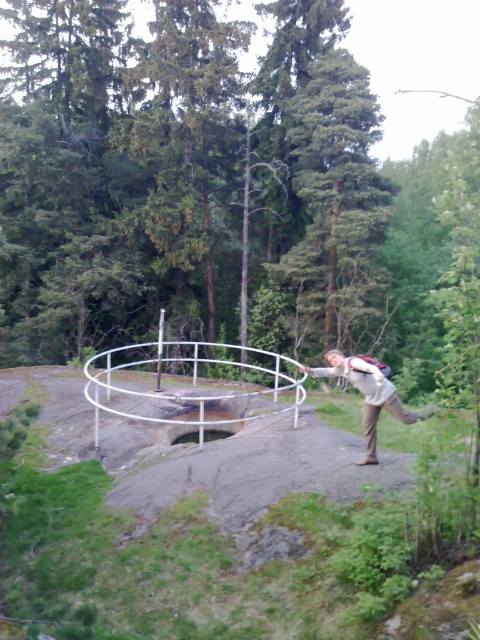
Question: Observing the image, what is the correct spatial positioning of white metal hula hoop at center in reference to light beige fabric backpack at center?

Choices:
 (A) above
 (B) below

Answer: (B)

Question: Which point is closer to the camera taking this photo?

Choices:
 (A) (359, 384)
 (B) (190, 344)

Answer: (A)

Question: Which point appears closest to the camera in this image?

Choices:
 (A) (402, 406)
 (B) (101, 384)

Answer: (A)

Question: Does white metal hula hoop at center appear on the right side of light beige fabric backpack at center?

Choices:
 (A) no
 (B) yes

Answer: (A)

Question: Can you confirm if white metal hula hoop at center is positioned to the right of light beige fabric backpack at center?

Choices:
 (A) no
 (B) yes

Answer: (A)

Question: Which of the following is the farthest from the observer?

Choices:
 (A) light beige fabric backpack at center
 (B) white metal hula hoop at center

Answer: (B)